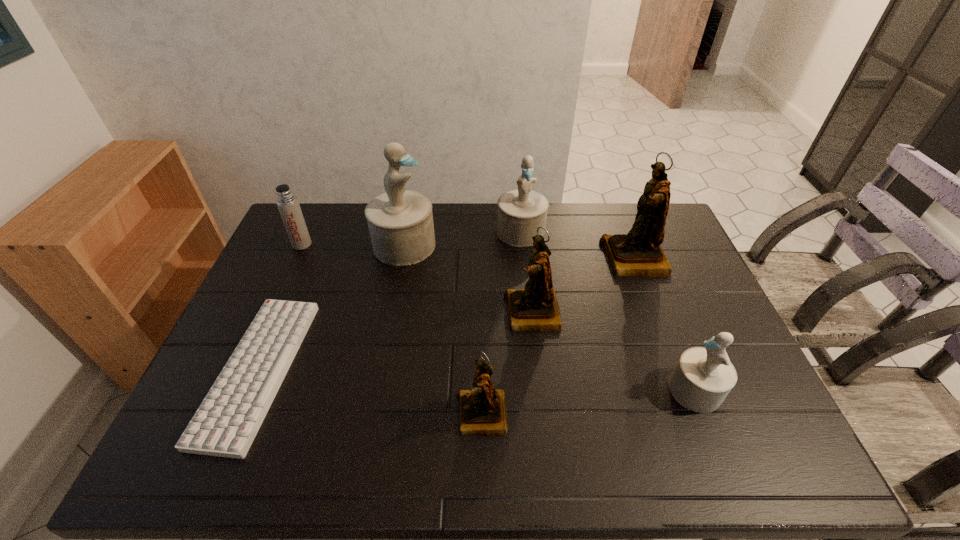
Locate an element on the screen. This screenshot has width=960, height=540. the leftmost gold figurine is located at coordinates (483, 412).

The width and height of the screenshot is (960, 540). I want to click on the nearest gold figurine, so 483,412.

Identify the location of computer keyboard. The height and width of the screenshot is (540, 960). (225, 424).

Identify the location of free location located at the beak of the third object from left to right. This screenshot has height=540, width=960. (546, 245).

Locate an element on the screen. The height and width of the screenshot is (540, 960). free space located 0.070m on the front-facing side of the biggest gold figurine is located at coordinates (583, 259).

This screenshot has height=540, width=960. In order to click on free location located 0.070m on the front-facing side of the biggest gold figurine in this screenshot , I will do `click(583, 259)`.

Identify the location of vacant space located on the front-facing side of the biggest gold figurine. This screenshot has height=540, width=960. (564, 259).

The width and height of the screenshot is (960, 540). I want to click on blank area located at the beak of the second biggest white figurine, so [x=527, y=287].

Find the location of a particular element. free space located 0.080m on the front-facing side of the second nearest gold figurine is located at coordinates (477, 313).

Identify the location of free space located 0.180m on the front-facing side of the second nearest gold figurine. The height and width of the screenshot is (540, 960). (444, 313).